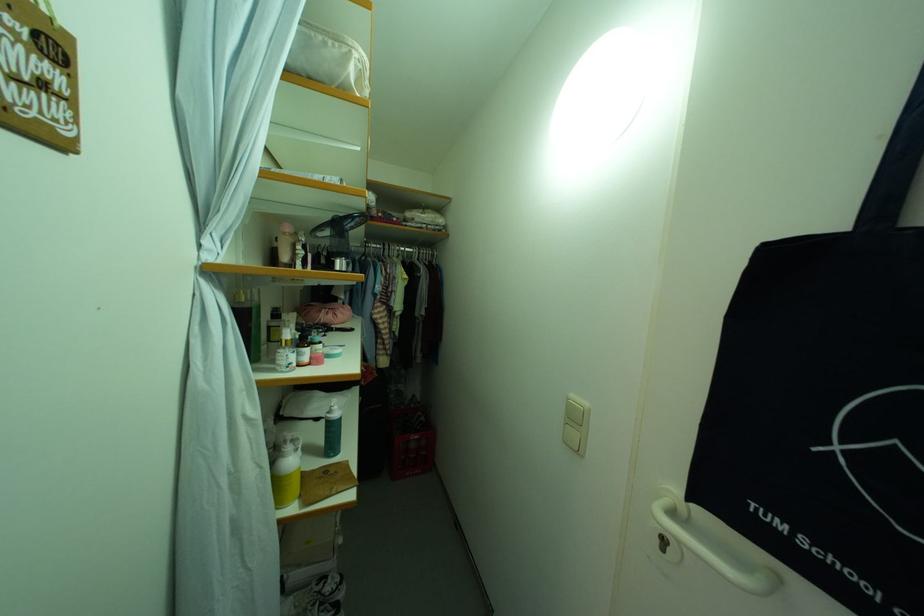
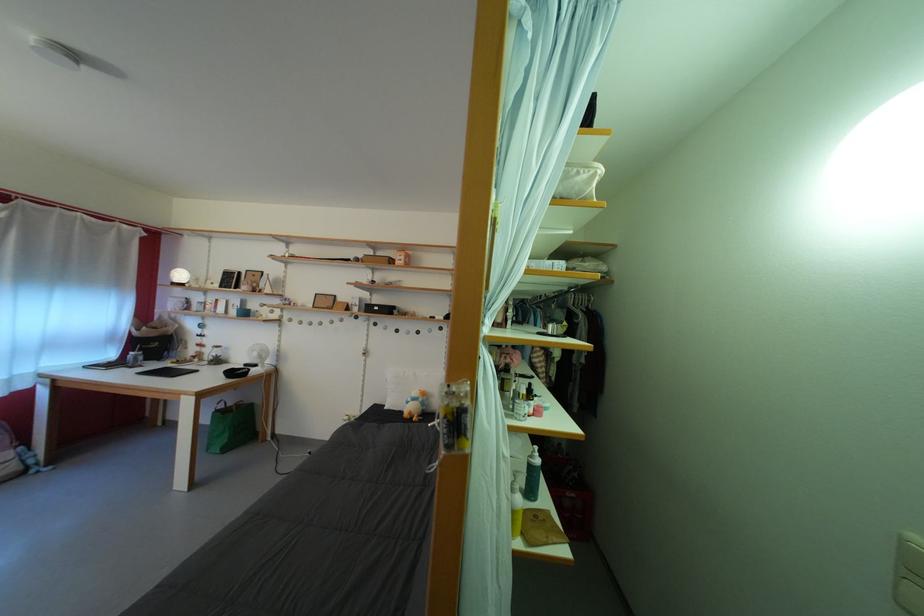
The point at (334, 51) is marked in the first image. Where is the corresponding point in the second image?

(587, 179)